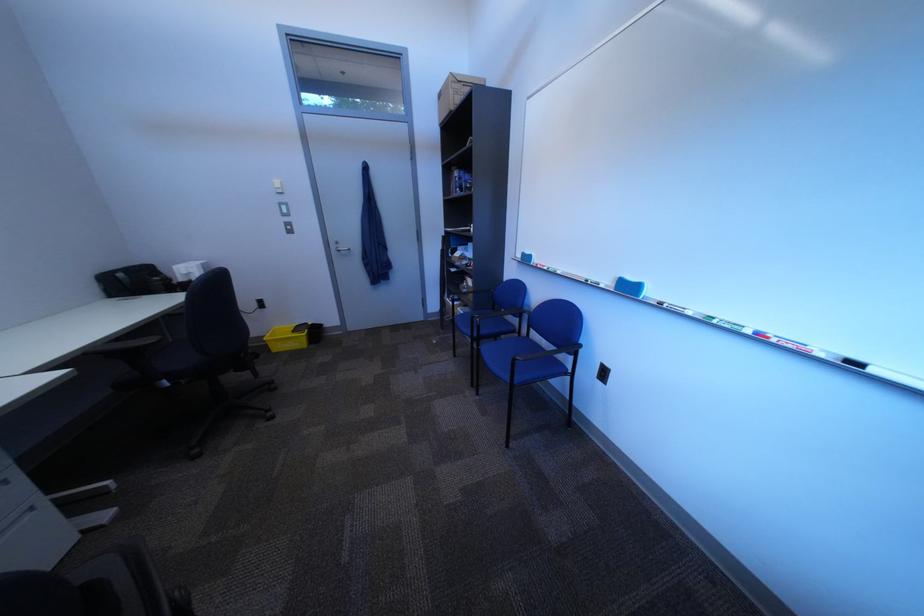
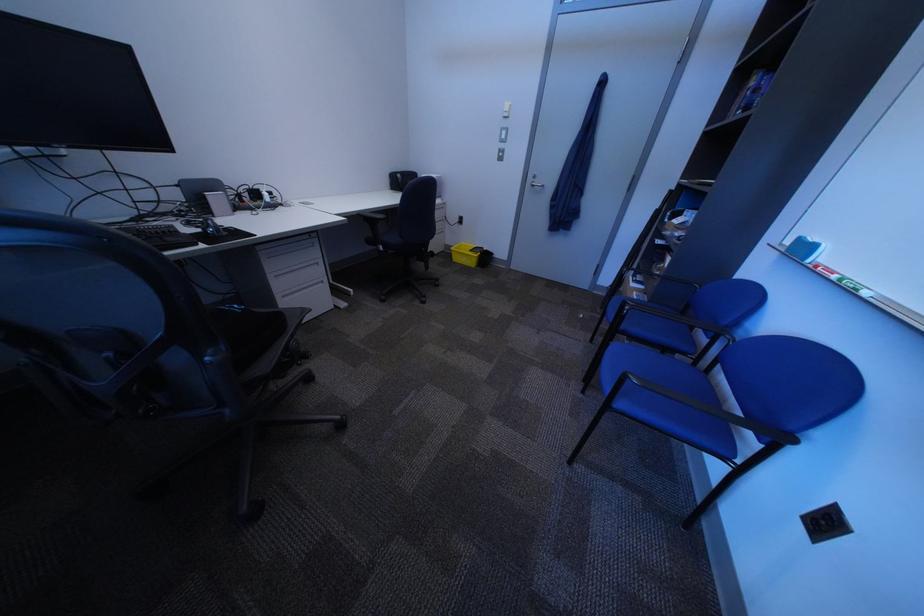
In the second image, find the point that corresponds to pixel 528 365 in the first image.

(636, 379)